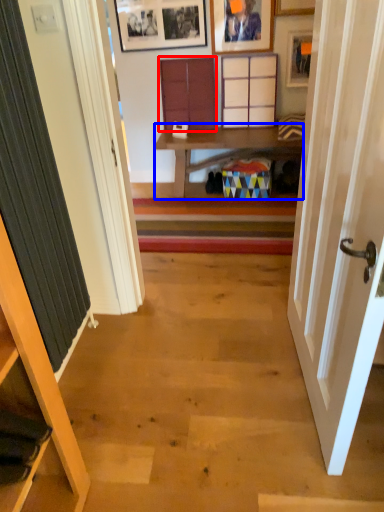
Question: Which object appears farthest to the camera in this image, cabinet (highlighted by a red box) or table (highlighted by a blue box)?

Choices:
 (A) cabinet
 (B) table

Answer: (A)